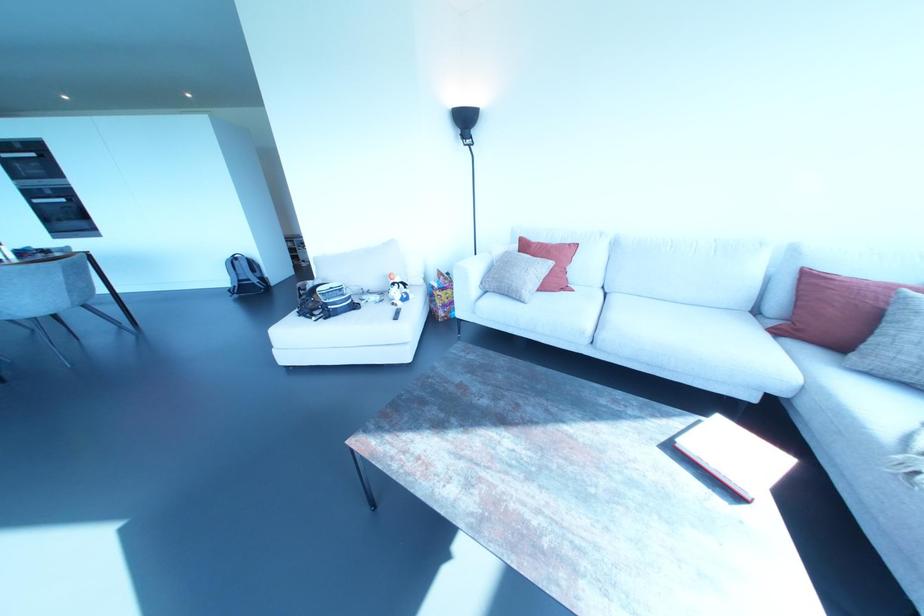
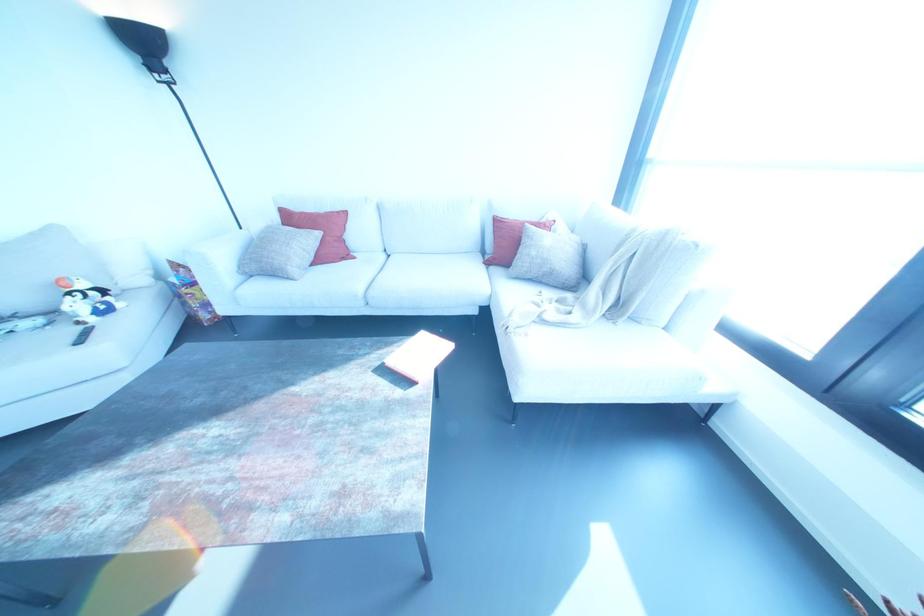
Question: The camera is either moving clockwise (left) or counter-clockwise (right) around the object. The first image is from the beginning of the video and the second image is from the end. Is the camera moving left or right when shooting the video?

Choices:
 (A) Left
 (B) Right

Answer: (A)